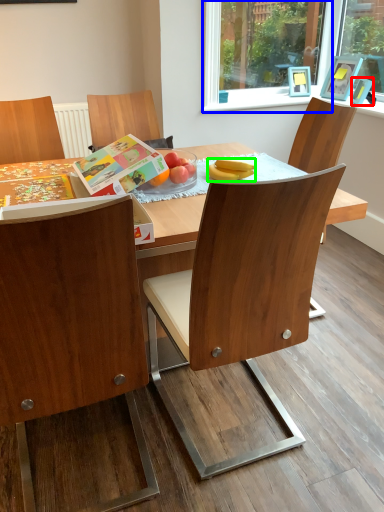
Question: Which is nearer to the picture frame (highlighted by a red box)? window frame (highlighted by a blue box) or banana (highlighted by a green box).

Choices:
 (A) window frame
 (B) banana

Answer: (A)